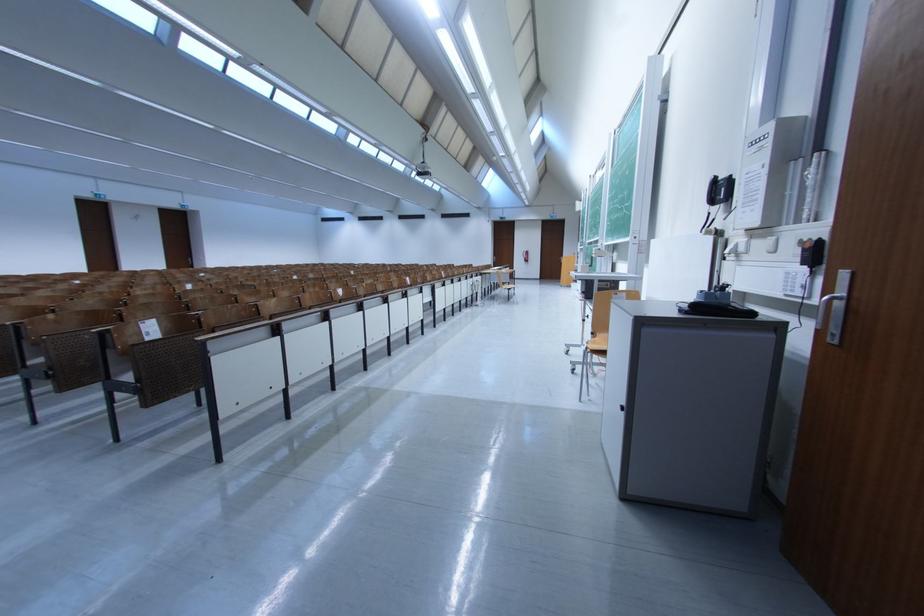
What are the coordinates of `black cabinet handle` in the screenshot? It's located at (623, 405).